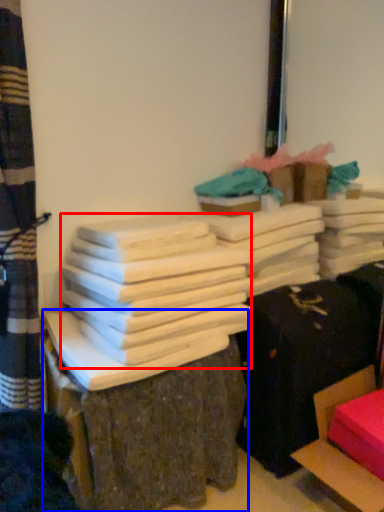
Question: Which of the following is the closest to the observer, bundle (highlighted by a red box) or furniture (highlighted by a blue box)?

Choices:
 (A) bundle
 (B) furniture

Answer: (B)